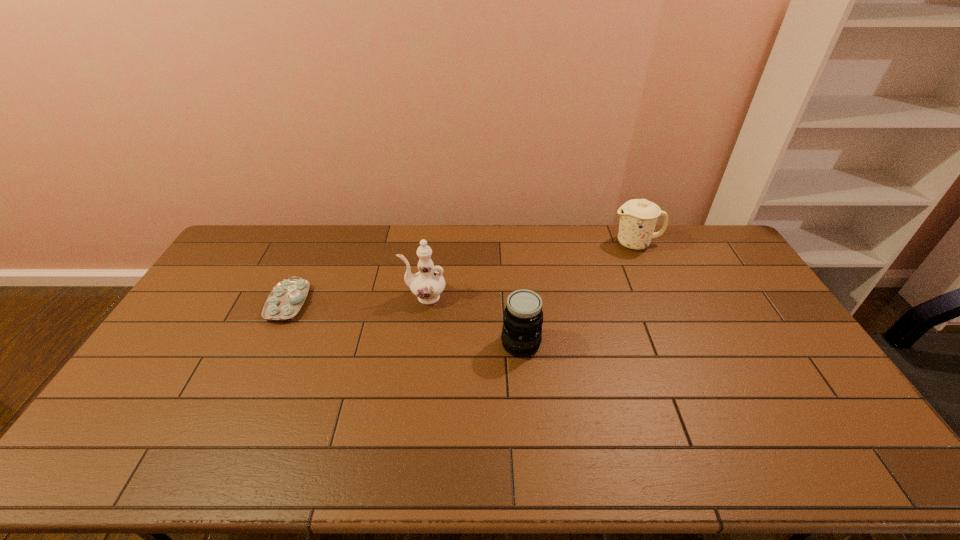
The height and width of the screenshot is (540, 960). I want to click on free spot located at the spout of the second chinaware from left to right, so click(x=327, y=296).

Where is `vacant position located on the spout of the farthest chinaware`? Image resolution: width=960 pixels, height=540 pixels. vacant position located on the spout of the farthest chinaware is located at coordinates (551, 244).

Identify the location of free space located on the spout of the farthest chinaware. The width and height of the screenshot is (960, 540). (594, 244).

The height and width of the screenshot is (540, 960). What are the coordinates of `vacant region located 0.220m on the spout of the farthest chinaware` in the screenshot? It's located at (553, 244).

Where is `vacant point located on the left of the nearest object`? The width and height of the screenshot is (960, 540). vacant point located on the left of the nearest object is located at coordinates (388, 343).

This screenshot has height=540, width=960. I want to click on vacant space situated 0.150m on the left of the leftmost object, so click(x=224, y=303).

Where is `object that is at the far edge`? object that is at the far edge is located at coordinates (638, 217).

In the image, there is a desktop. In order to click on free space at the far edge in this screenshot , I will do `click(493, 233)`.

In order to click on vacant space at the near edge of the desktop in this screenshot , I will do `click(327, 467)`.

Where is `vacant space at the left edge of the desktop`? vacant space at the left edge of the desktop is located at coordinates (166, 418).